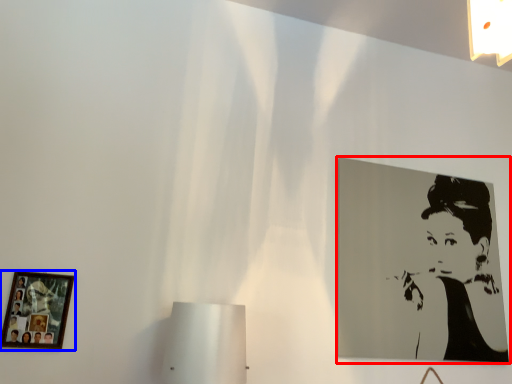
Question: Which point is further to the camera, picture frame (highlighted by a red box) or picture frame (highlighted by a blue box)?

Choices:
 (A) picture frame
 (B) picture frame

Answer: (A)